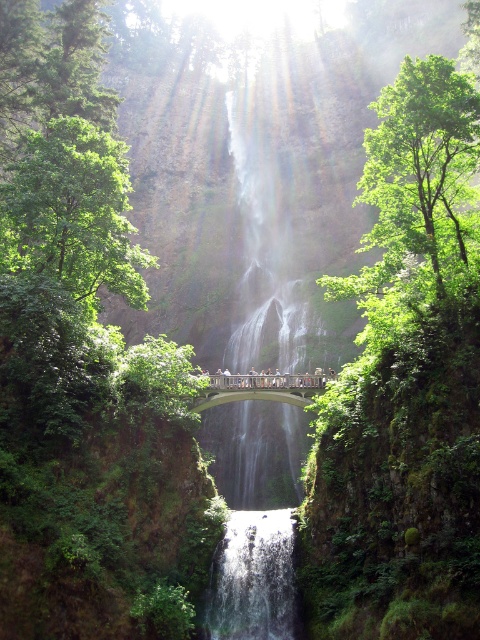
Can you confirm if clear water at center is smaller than wooden bridge at center?

Incorrect, clear water at center is not smaller in size than wooden bridge at center.

Which is in front, point (240, 602) or point (230, 385)?

Point (240, 602)

At what (x,y) coordinates should I click in order to perform the action: click on clear water at center. Please return your answer as a coordinate pair (x, y). Looking at the image, I should click on (252, 579).